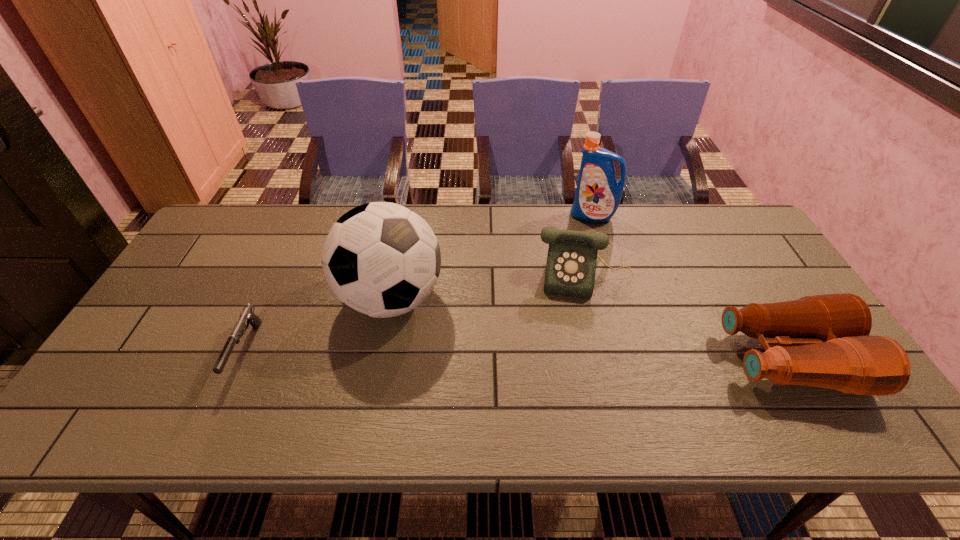
Where is `empty location between the binoculars and the telephone`? This screenshot has width=960, height=540. empty location between the binoculars and the telephone is located at coordinates (687, 318).

Where is `empty space between the gun and the telephone`? The height and width of the screenshot is (540, 960). empty space between the gun and the telephone is located at coordinates (416, 313).

Find the location of a particular element. free spot between the rightmost object and the telephone is located at coordinates (687, 318).

The image size is (960, 540). What are the coordinates of `unoccupied position between the second object from left to right and the detergent` in the screenshot? It's located at (492, 258).

Identify which object is the fourth nearest to the farthest object. Please provide its 2D coordinates. Your answer should be formatted as a tuple, i.e. [(x, y)], where the tuple contains the x and y coordinates of a point satisfying the conditions above.

[(247, 315)]

Choose which object is the second nearest neighbor to the shortest object. Please provide its 2D coordinates. Your answer should be formatted as a tuple, i.e. [(x, y)], where the tuple contains the x and y coordinates of a point satisfying the conditions above.

[(572, 255)]

Find the location of a particular element. The width and height of the screenshot is (960, 540). vacant space that satisfies the following two spatial constraints: 1. at the muzzle end of the rightmost object; 2. through the lenses of the shortest object is located at coordinates click(x=242, y=360).

The height and width of the screenshot is (540, 960). Find the location of `free space that satisfies the following two spatial constraints: 1. on the back side of the detergent; 2. on the right side of the fourth object from right to left`. free space that satisfies the following two spatial constraints: 1. on the back side of the detergent; 2. on the right side of the fourth object from right to left is located at coordinates (407, 217).

Identify the location of vacant space that satisfies the following two spatial constraints: 1. on the front side of the rightmost object; 2. through the lenses of the telephone. The height and width of the screenshot is (540, 960). (607, 360).

The width and height of the screenshot is (960, 540). I want to click on free spot that satisfies the following two spatial constraints: 1. on the back side of the soccer ball; 2. on the left side of the farthest object, so click(x=407, y=217).